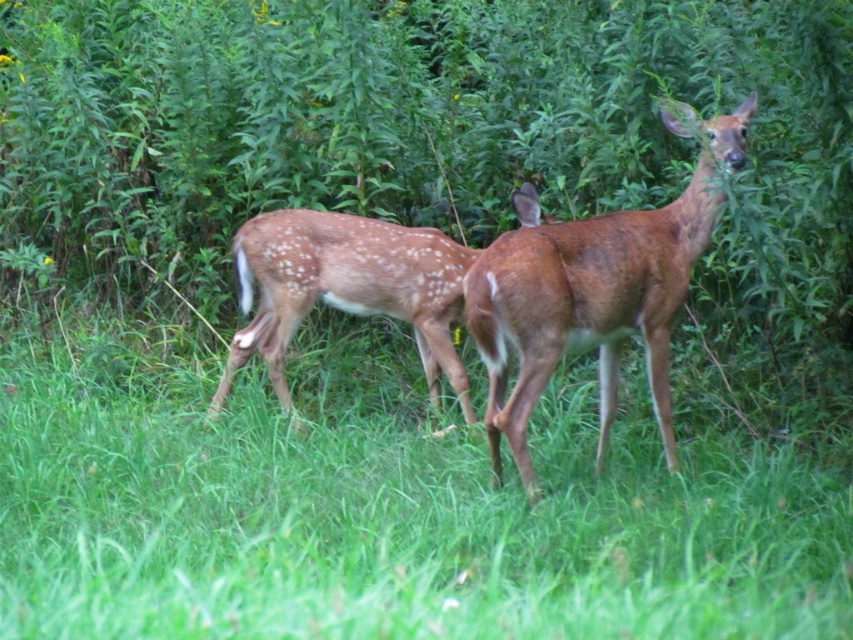
You are a photographer trying to capture the brown speckled fur at center of the deer. You notice the green grass at center might obstruct the view. Based on the scene, can you determine if the grass will block the deer from your camera lens?

The green grass at center is shorter than the brown speckled fur at center, so the grass will not block the deer from your camera lens since the deer is taller than the grass.